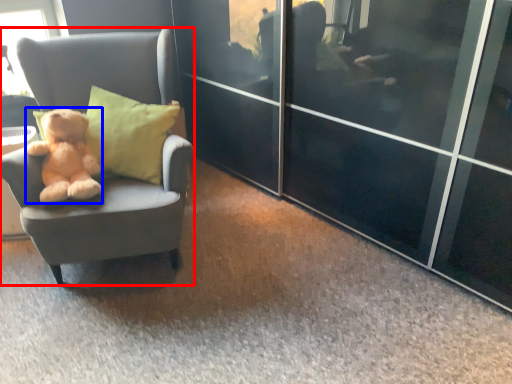
Question: Which of the following is the farthest to the observer, chair (highlighted by a red box) or teddy bear (highlighted by a blue box)?

Choices:
 (A) chair
 (B) teddy bear

Answer: (B)